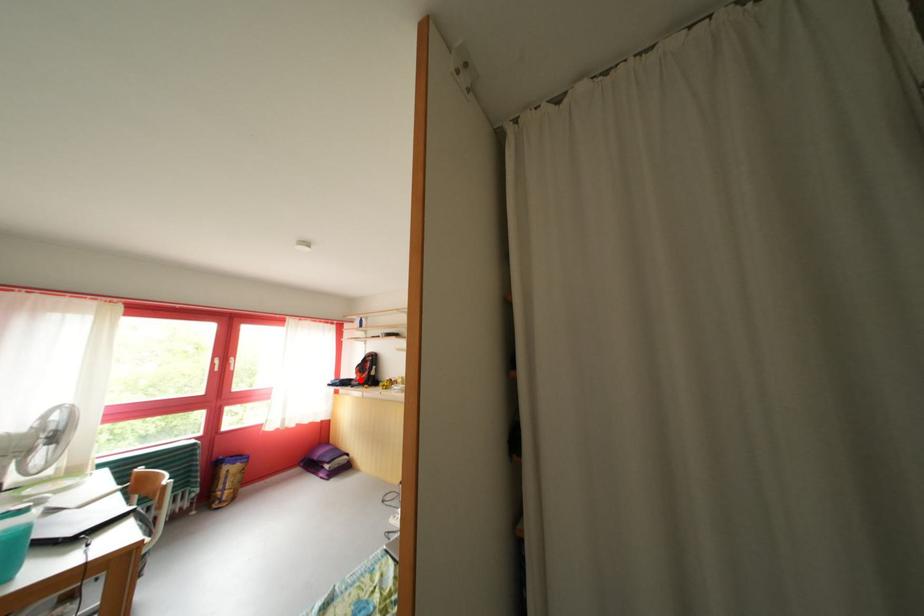
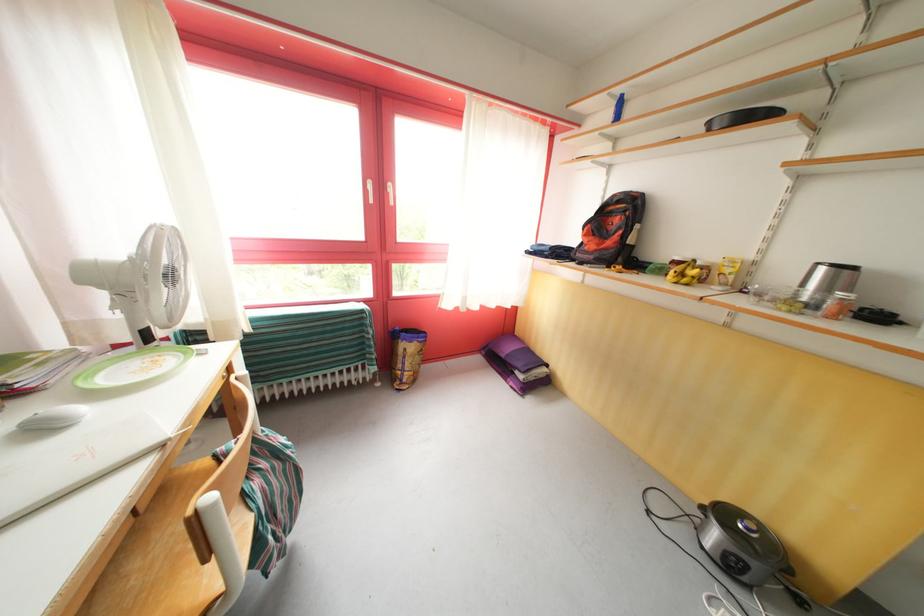
The point at the highlighted location is marked in the first image. Where is the corresponding point in the second image?

(580, 245)